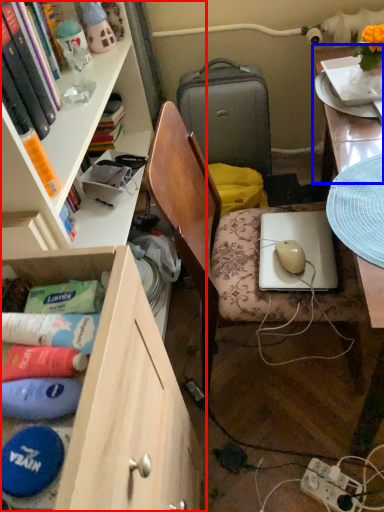
Question: Which object appears farthest to the camera in this image, cabinetry (highlighted by a red box) or table top (highlighted by a blue box)?

Choices:
 (A) cabinetry
 (B) table top

Answer: (B)